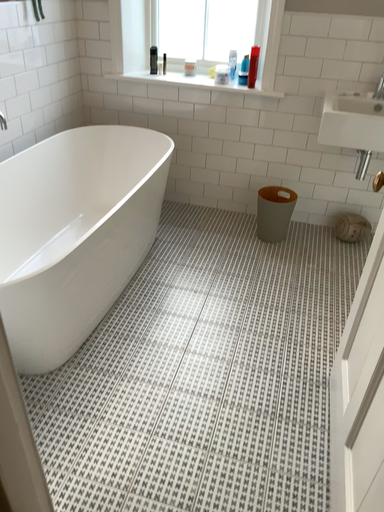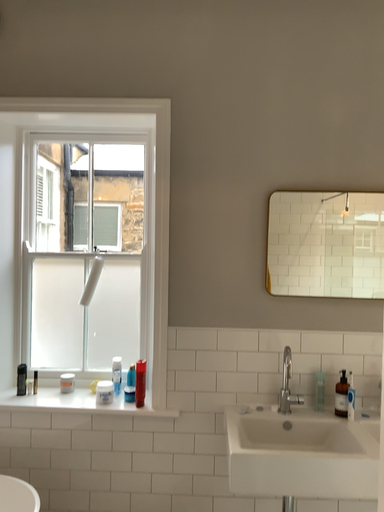
Question: How did the camera likely rotate when shooting the video?

Choices:
 (A) rotated downward
 (B) rotated upward

Answer: (B)